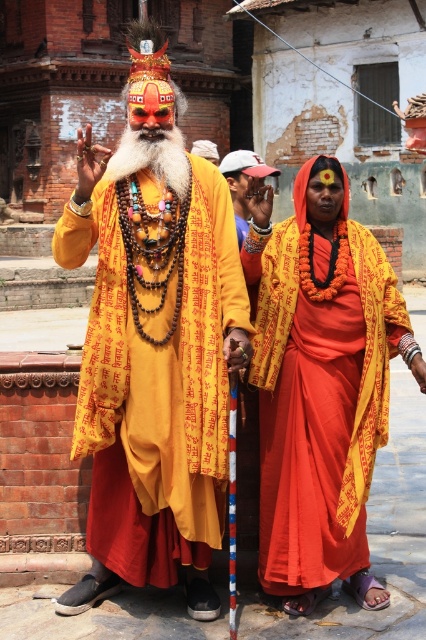
You are a photographer trying to capture both the orange silk sari at center and the white fluffy beard at center in a single frame. Given their sizes, which one should you focus on to ensure both fit comfortably in the photo?

The orange silk sari at center is narrower than the white fluffy beard at center, so focusing on the white fluffy beard at center would allow both to fit comfortably in the photo.

You are a photographer trying to capture the best angle of the scene. You notice two specific points marked in the image. Which of these points, point (63, 250) or point (178, 173), is closer to your camera lens?

Point (63, 250) is closer to the camera lens than point (178, 173).

You are a photographer trying to capture both the matte yellow robe at center and the orange silk sari at center in a single frame. Based on their positions, which one should you focus on first to ensure both are in the frame?

The matte yellow robe at center is above the orange silk sari at center, so you should focus on the orange silk sari at center first to ensure both are in the frame.